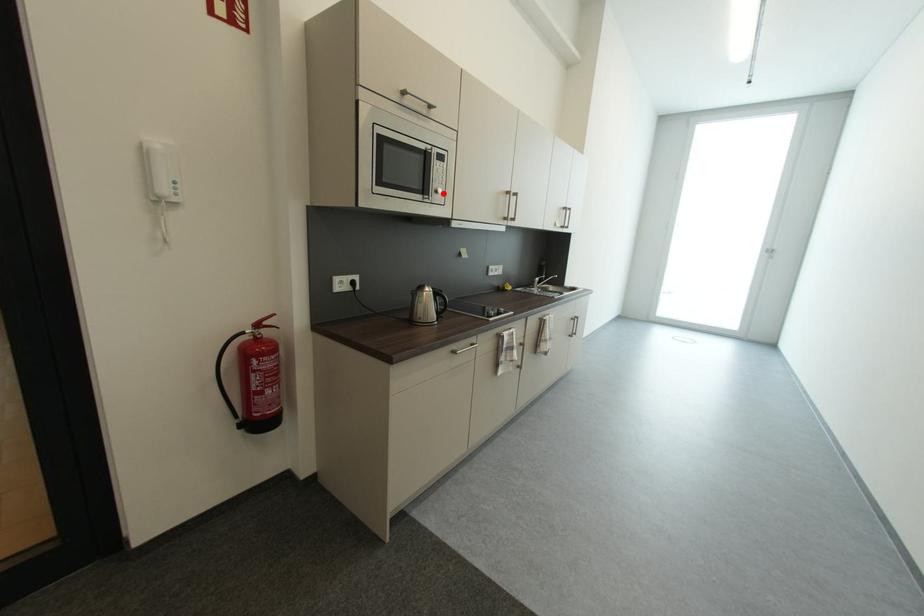
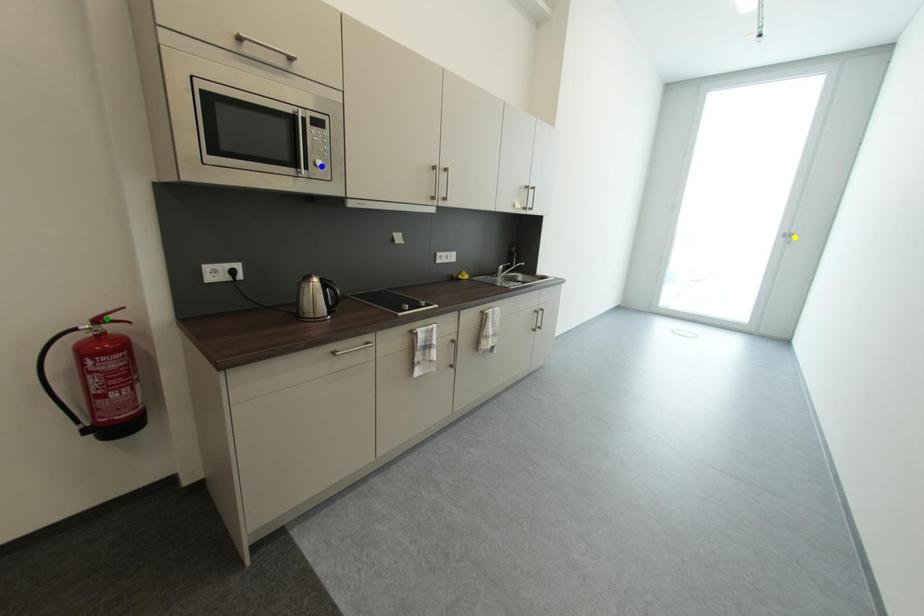
Question: I am providing you with two images of the same scene from different viewpoints. A red point is marked on the first image. You are given multiple points on the second image. Which point in image 2 represents the same 3d spot as the red point in image 1?

Choices:
 (A) blue point
 (B) green point
 (C) yellow point

Answer: (A)